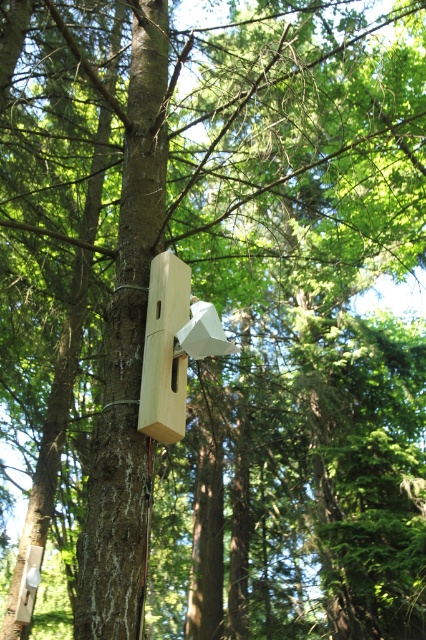
Question: Does smooth brown tree trunk at center appear on the right side of natural wood bird feeder at center?

Choices:
 (A) no
 (B) yes

Answer: (A)

Question: Can you confirm if smooth brown tree trunk at center is positioned above natural wood bird feeder at center?

Choices:
 (A) yes
 (B) no

Answer: (A)

Question: Which point is closer to the camera taking this photo?

Choices:
 (A) (176, 272)
 (B) (160, 128)

Answer: (A)

Question: Among these points, which one is nearest to the camera?

Choices:
 (A) (158, 369)
 (B) (112, 406)

Answer: (A)

Question: Can you confirm if smooth brown tree trunk at center is wider than natural wood bird feeder at center?

Choices:
 (A) yes
 (B) no

Answer: (A)

Question: Which point is closer to the camera?

Choices:
 (A) smooth brown tree trunk at center
 (B) natural wood bird feeder at center

Answer: (A)